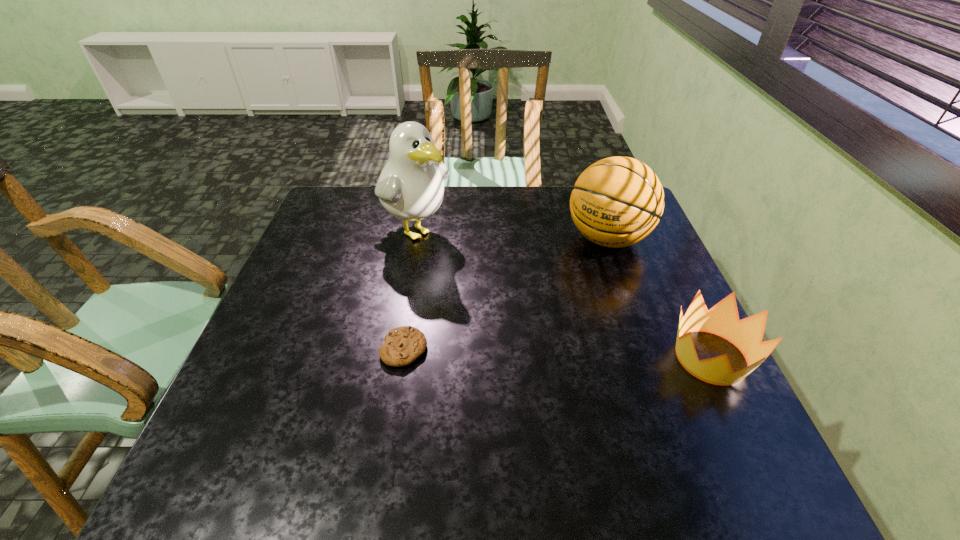
Locate an element on the screen. This screenshot has height=540, width=960. free location located on the beak of the gull is located at coordinates (510, 298).

The width and height of the screenshot is (960, 540). In order to click on blank area located on the beak of the gull in this screenshot , I will do `click(501, 292)`.

You are a GUI agent. You are given a task and a screenshot of the screen. Output one action in this format:
    pyautogui.click(x=<x>, y=<y>)
    Task: Click on the basketball located at the far edge
    
    Given the screenshot: What is the action you would take?
    pyautogui.click(x=616, y=202)

Where is `gull that is at the far edge`? The width and height of the screenshot is (960, 540). gull that is at the far edge is located at coordinates (410, 187).

At what (x,y) coordinates should I click in order to perform the action: click on crown present at the right edge. Please return your answer as a coordinate pair (x, y). The height and width of the screenshot is (540, 960). Looking at the image, I should click on (746, 334).

Where is `basketball located at the right edge`? This screenshot has width=960, height=540. basketball located at the right edge is located at coordinates coord(616,202).

Image resolution: width=960 pixels, height=540 pixels. Find the location of `object located in the far right corner section of the desktop`. object located in the far right corner section of the desktop is located at coordinates (616, 202).

Identify the location of vacant area at the far edge of the desktop. This screenshot has height=540, width=960. (500, 190).

Locate an element on the screen. free point at the near edge is located at coordinates (x=403, y=412).

This screenshot has height=540, width=960. I want to click on free space at the left edge of the desktop, so click(272, 348).